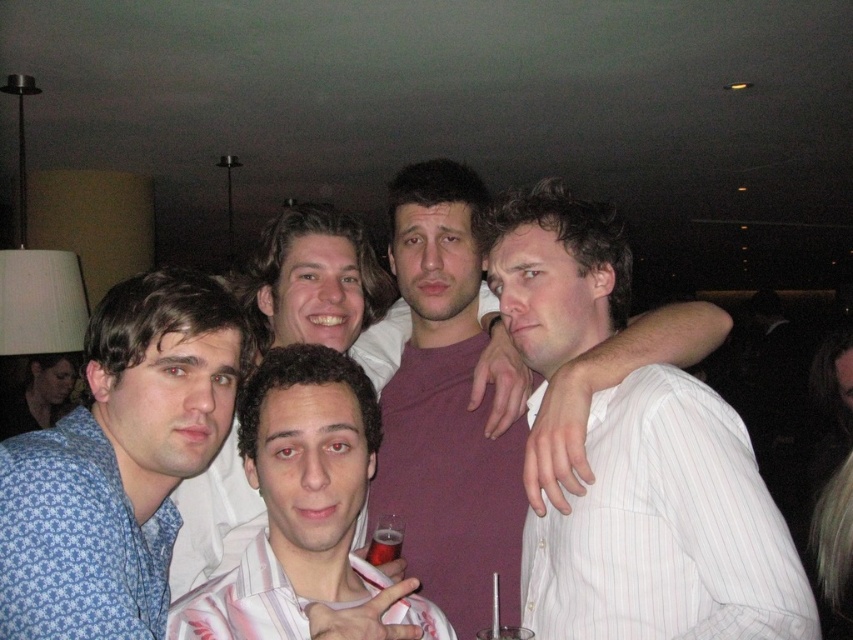
Question: From the image, what is the correct spatial relationship of matte purple shirt at center in relation to white pinstriped shirt at right?

Choices:
 (A) left
 (B) right

Answer: (A)

Question: Does matte purple shirt at center have a lesser width compared to blue patterned shirt at left?

Choices:
 (A) no
 (B) yes

Answer: (A)

Question: Is matte purple shirt at center positioned before white striped shirt at center?

Choices:
 (A) no
 (B) yes

Answer: (A)

Question: Which point appears closest to the camera in this image?

Choices:
 (A) (711, 428)
 (B) (397, 540)
 (C) (136, 468)
 (D) (198, 595)

Answer: (D)

Question: Estimate the real-world distances between objects in this image. Which object is farther from the translucent plastic cup at center?

Choices:
 (A) blue floral fabric shirt at left
 (B) white pinstriped shirt at right
 (C) blue patterned shirt at left

Answer: (A)

Question: Which point appears farthest from the camera in this image?

Choices:
 (A) (393, 522)
 (B) (67, 608)
 (C) (427, 634)

Answer: (A)